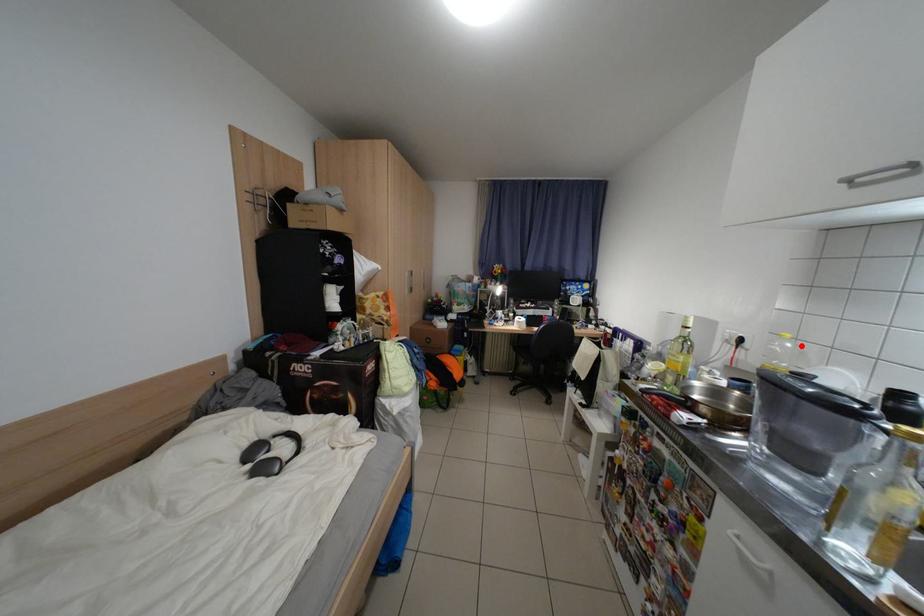
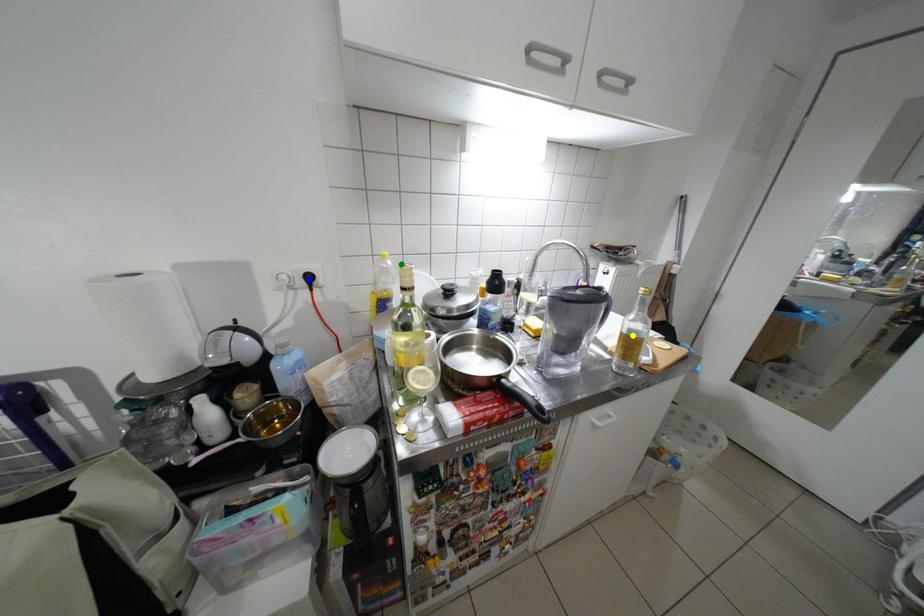
Question: I am providing you with two images of the same scene from different viewpoints. A red point is marked on the first image. You are given multiple points on the second image. Can you choose the point in image 2 that corresponds to the point in image 1?

Choices:
 (A) green point
 (B) yellow point
 (C) blue point

Answer: (A)